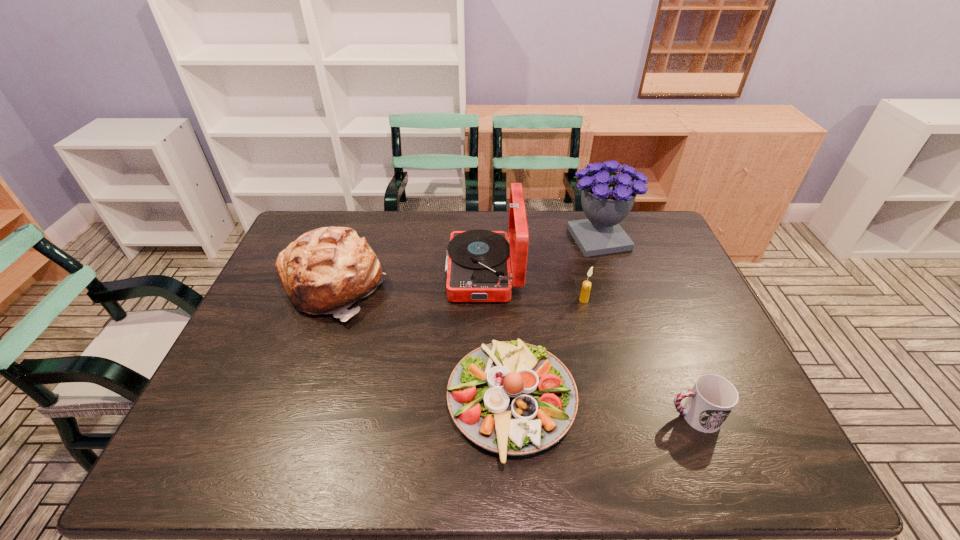
Where is `object that is at the near edge`? This screenshot has width=960, height=540. object that is at the near edge is located at coordinates (512, 398).

At what (x,y) coordinates should I click in order to perform the action: click on object present at the left edge. Please return your answer as a coordinate pair (x, y). The height and width of the screenshot is (540, 960). Looking at the image, I should click on (326, 270).

Image resolution: width=960 pixels, height=540 pixels. I want to click on bouquet present at the right edge, so click(x=607, y=198).

Where is `cup that is at the right edge`? cup that is at the right edge is located at coordinates (711, 400).

Find the location of `object situated at the far left corner`. object situated at the far left corner is located at coordinates 326,270.

Where is `object located at the far right corner`? object located at the far right corner is located at coordinates (607, 198).

You are a GUI agent. You are given a task and a screenshot of the screen. Output one action in this format:
    pyautogui.click(x=<x>, y=<y>)
    Task: Click on the free region at the far edge of the desktop
    The image size is (960, 540).
    Given the screenshot: What is the action you would take?
    pyautogui.click(x=552, y=249)

You are a GUI agent. You are given a task and a screenshot of the screen. Output one action in this format:
    pyautogui.click(x=<x>, y=<y>)
    Task: Click on the vacant area at the left edge of the desktop
    
    Given the screenshot: What is the action you would take?
    pyautogui.click(x=283, y=330)

The height and width of the screenshot is (540, 960). I want to click on vacant space at the right edge of the desktop, so [667, 294].

This screenshot has height=540, width=960. In order to click on vacant space at the far left corner in this screenshot , I will do `click(304, 227)`.